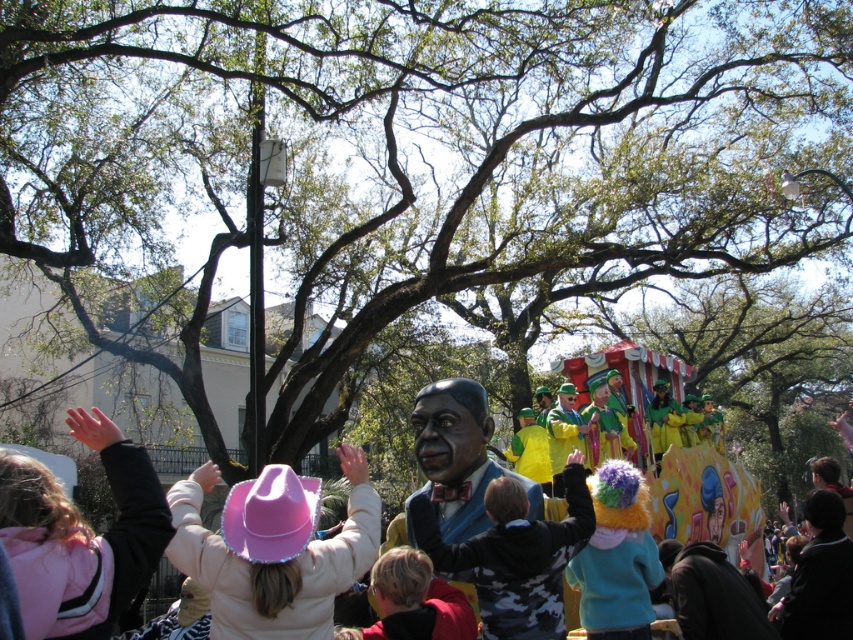
You are standing in the parade watching the float. You notice two points on the float at coordinates point (483, 508) and point (610, 508). Which point is closer to you?

Point (483, 508) is further to the camera than point (610, 508), so the point closer to you is point (610, 508).

You are a photographer at the parade and want to capture both the matte blue suit at center and the fluffy multicolored wig at center in the same frame. Based on their positions, which object should you position closer to the left side of your camera viewfinder to include both?

To include both the matte blue suit at center and the fluffy multicolored wig at center in the same frame, position the matte blue suit at center closer to the left side of the camera viewfinder since it is already to the left of the fluffy multicolored wig at center.

A photographer wants to capture both the child wearing a pink cowboy hat and the large float in the same frame. The camera is positioned at point (427, 435). Given that the distance between them is 38.37 meters, is it possible to fit both subjects into the frame without moving the camera?

The distance between the child wearing a pink cowboy hat and the large float is 38.37 meters. Since the camera is at point (427, 435), it depends on the camera lens and sensor size. However, standard lenses typically have a field of view that can cover such distances in a single frame, so it might be possible if the photographer uses an appropriate lens.